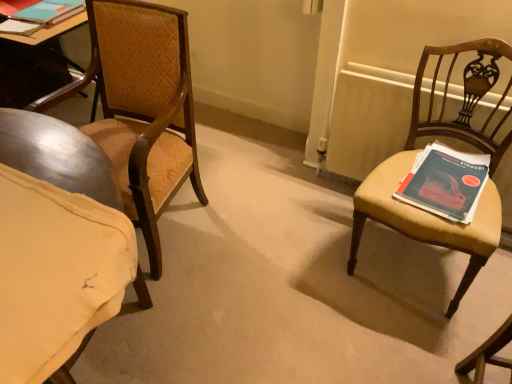
At what (x,y) coordinates should I click in order to perform the action: click on vacant area in front of wooden textured chair at left, acting as the 1th chair starting from the left. Please return your answer as a coordinate pair (x, y). The image size is (512, 384). Looking at the image, I should click on (168, 326).